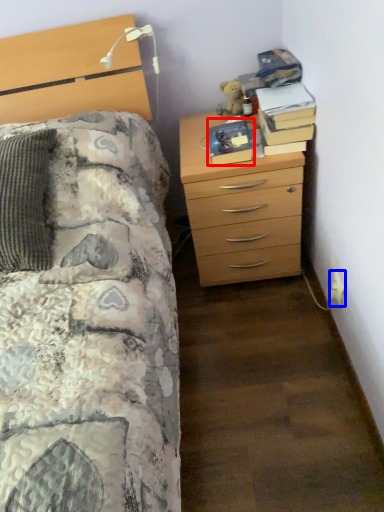
Question: Which object is closer to the camera taking this photo, book (highlighted by a red box) or electric outlet (highlighted by a blue box)?

Choices:
 (A) book
 (B) electric outlet

Answer: (B)